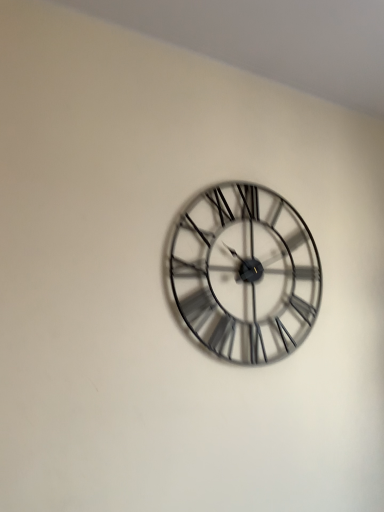
Identify the location of metallic gray clock at center. (245, 273).

What do you see at coordinates (245, 273) in the screenshot? I see `metallic gray clock at center` at bounding box center [245, 273].

Find the location of a particular element. This screenshot has height=512, width=384. metallic gray clock at center is located at coordinates 245,273.